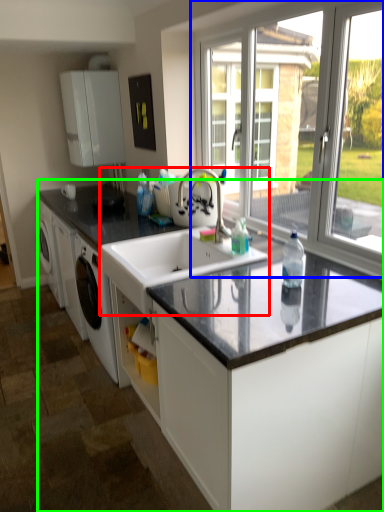
Question: Based on their relative distances, which object is farther from sink (highlighted by a red box)? Choose from window (highlighted by a blue box) and countertop (highlighted by a green box).

Choices:
 (A) window
 (B) countertop

Answer: (A)